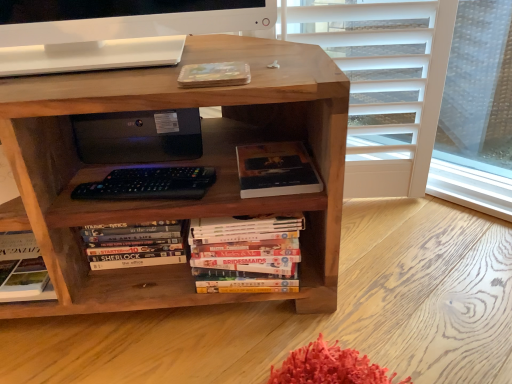
Question: Considering the relative positions of brown wood bookcase at center and hardcover book at center, which ranks as the 3th book in right-to-left order, in the image provided, is brown wood bookcase at center to the left of hardcover book at center, which ranks as the 3th book in right-to-left order, from the viewer's perspective?

Choices:
 (A) yes
 (B) no

Answer: (A)

Question: Is brown wood bookcase at center not close to hardcover book at center, the 1th book positioned from the left?

Choices:
 (A) no
 (B) yes

Answer: (A)

Question: Can you see brown wood bookcase at center touching hardcover book at center, which ranks as the 3th book in right-to-left order?

Choices:
 (A) no
 (B) yes

Answer: (A)

Question: From a real-world perspective, is brown wood bookcase at center located higher than hardcover book at center, which ranks as the 3th book in right-to-left order?

Choices:
 (A) no
 (B) yes

Answer: (B)

Question: Can you confirm if brown wood bookcase at center is shorter than hardcover book at center, the 1th book positioned from the left?

Choices:
 (A) no
 (B) yes

Answer: (A)

Question: Do you think hardcover book at center, the 1th book positioned from the left, is within hardcover book at center, the 3th book when ordered from left to right, or outside of it?

Choices:
 (A) outside
 (B) inside

Answer: (A)

Question: Relative to hardcover book at center, the 3th book when ordered from left to right, is hardcover book at center, the 1th book positioned from the left, in front or behind?

Choices:
 (A) front
 (B) behind

Answer: (B)

Question: In terms of width, does hardcover book at center, which ranks as the 3th book in right-to-left order, look wider or thinner when compared to hardcover book at center, marked as the first book in a right-to-left arrangement?

Choices:
 (A) wide
 (B) thin

Answer: (B)

Question: Is point (126, 228) positioned closer to the camera than point (286, 153)?

Choices:
 (A) closer
 (B) farther

Answer: (B)

Question: Considering the positions of hardcover book at center, the 3th book when ordered from left to right, and hardcover books at center, which is the second book from right to left, in the image, is hardcover book at center, the 3th book when ordered from left to right, taller or shorter than hardcover books at center, which is the second book from right to left,?

Choices:
 (A) tall
 (B) short

Answer: (B)

Question: Looking at their shapes, would you say hardcover book at center, marked as the first book in a right-to-left arrangement, is wider or thinner than hardcover books at center, which is the second book from right to left?

Choices:
 (A) thin
 (B) wide

Answer: (B)

Question: From the image's perspective, is hardcover book at center, marked as the first book in a right-to-left arrangement, above or below hardcover books at center, the second book in the left-to-right sequence?

Choices:
 (A) above
 (B) below

Answer: (A)

Question: Is point (251, 195) positioned closer to the camera than point (238, 286)?

Choices:
 (A) closer
 (B) farther

Answer: (A)

Question: Is point (117, 292) positioned closer to the camera than point (244, 223)?

Choices:
 (A) farther
 (B) closer

Answer: (A)

Question: Is brown wood bookcase at center in front of or behind hardcover books at center, which is the second book from right to left, in the image?

Choices:
 (A) front
 (B) behind

Answer: (A)